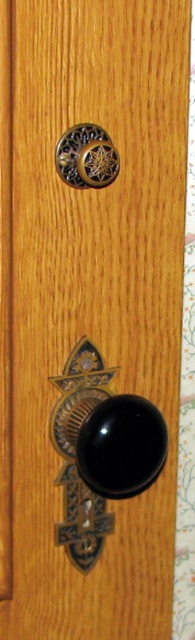
You are trying to open a door and need to choose between the black polished metal door handle at center and the gold textured knob at upper center. Which one is taller and more likely to be the main entry handle?

The black polished metal door handle at center is taller than the gold textured knob at upper center, so it is more likely to be the main entry handle.

You are standing in front of a wooden door with two doorknobs. You notice two points marked on the door at coordinates point (75, 497) and point (68, 148). Which point is closer to you?

Point (68, 148) is closer to you because it is less further to the camera than point (75, 497).

You are trying to open the door and notice two handles. The black polished metal door handle at center and the gold textured knob at upper center. Which handle should you grab first if you want to open the door?

You should grab the black polished metal door handle at center first because it is closer to you than the gold textured knob at upper center, which is further away.